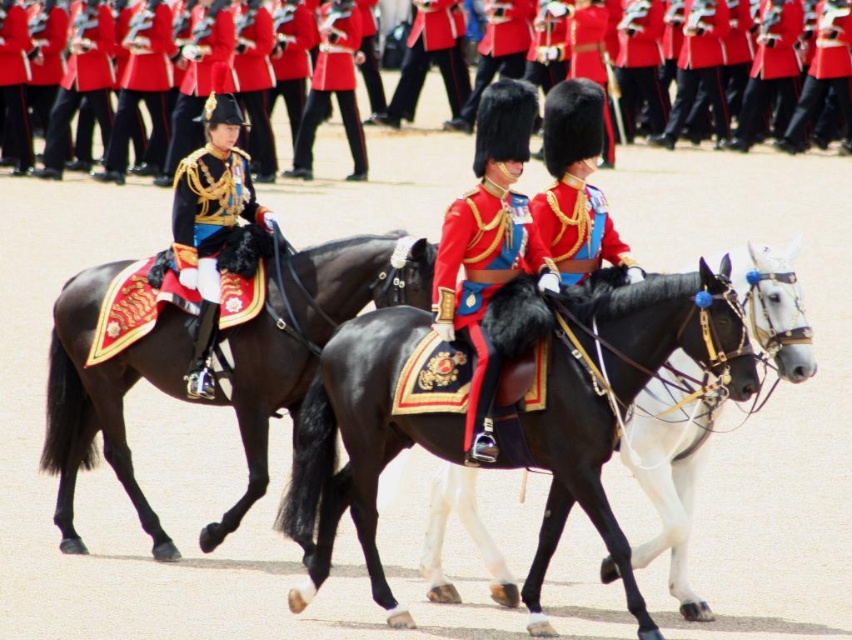
Can you confirm if black glossy horse at center is smaller than shiny red coat at center?

Yes.

Is black glossy horse at center thinner than shiny red coat at center?

Yes.

The image size is (852, 640). What do you see at coordinates (669, 467) in the screenshot? I see `black glossy horse at center` at bounding box center [669, 467].

This screenshot has width=852, height=640. I want to click on black glossy horse at center, so click(669, 467).

Between shiny red uniform at upper center and red woolen coat at center, which one appears on the right side from the viewer's perspective?

From the viewer's perspective, shiny red uniform at upper center appears more on the right side.

Is shiny red uniform at upper center smaller than red woolen coat at center?

Incorrect, shiny red uniform at upper center is not smaller in size than red woolen coat at center.

Which is behind, point (50, 76) or point (361, 164)?

Point (50, 76)

At what (x,y) coordinates should I click in order to perform the action: click on shiny red uniform at upper center. Please return your answer as a coordinate pair (x, y). This screenshot has width=852, height=640. Looking at the image, I should click on (10, 42).

Who is positioned more to the right, black glossy horse at center or shiny gold armor at center?

black glossy horse at center

Who is more forward, (678, 417) or (183, 195)?

Point (678, 417) is in front.

At what (x,y) coordinates should I click in order to perform the action: click on black glossy horse at center. Please return your answer as a coordinate pair (x, y). Looking at the image, I should click on (669, 467).